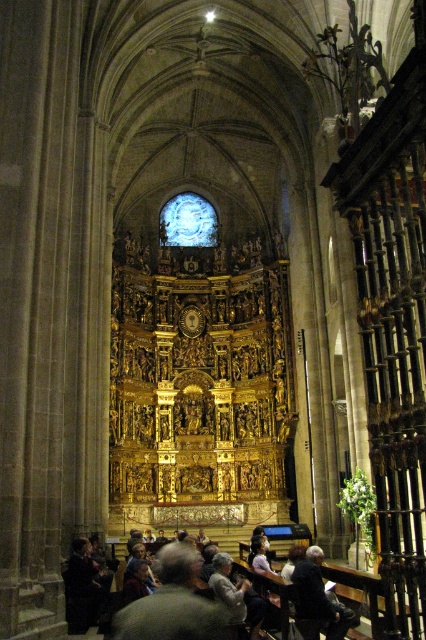
Question: In this image, where is gray wool sweater at lower center located relative to dark blue fabric at lower center?

Choices:
 (A) above
 (B) below

Answer: (B)

Question: Which of these objects is positioned closest to the dark blue fabric at lower center?

Choices:
 (A) dark gray sweater at lower left
 (B) gray wool sweater at lower center

Answer: (A)

Question: Observing the image, what is the correct spatial positioning of gray wool sweater at lower center in reference to dark blue fabric at lower center?

Choices:
 (A) left
 (B) right

Answer: (A)

Question: Which is nearer to the dark blue fabric at lower center?

Choices:
 (A) dark gray sweater at lower left
 (B) gray wool sweater at lower center

Answer: (A)

Question: Where is gray wool sweater at lower center located in relation to dark blue fabric at lower center in the image?

Choices:
 (A) right
 (B) left

Answer: (B)

Question: Considering the real-world distances, which object is farthest from the dark gray sweater at lower left?

Choices:
 (A) gray wool sweater at lower center
 (B) dark blue fabric at lower center

Answer: (A)